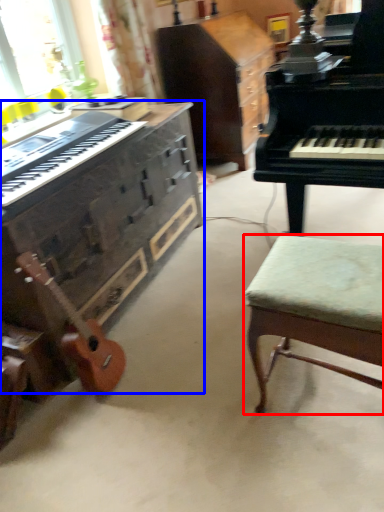
Question: Which point is further to the camera, stool (highlighted by a red box) or piano (highlighted by a blue box)?

Choices:
 (A) stool
 (B) piano

Answer: (B)